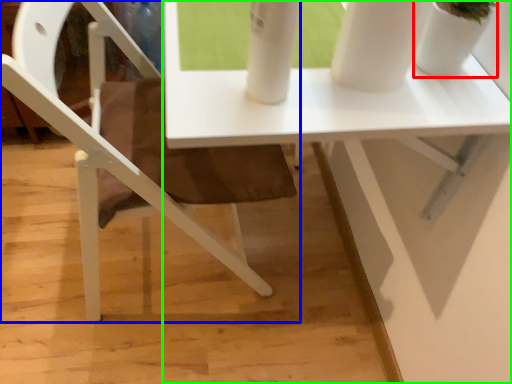
Question: Which object is the farthest from glass vase (highlighted by a red box)? Choose among these: chair (highlighted by a blue box) or table (highlighted by a green box).

Choices:
 (A) chair
 (B) table

Answer: (A)